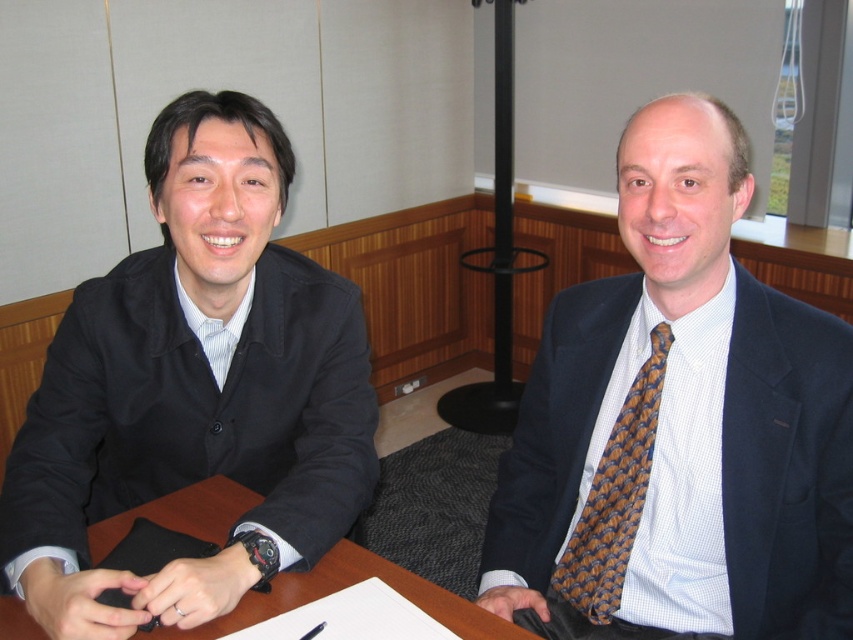
You are a tailor measuring the brown wooden table at center and the brown woven tie at right for a custom order. Which object has a greater width?

The brown wooden table at center has a greater width than the brown woven tie at right.

You are standing at the camera position and want to place a 36 inch wide object on the brown wooden table at center. Can the object fit on the table?

The distance between the brown wooden table at center and the camera is 37.96 inches, but this measurement refers to the distance from the camera to the table, not the table width. Therefore, we cannot determine if the 36 inch wide object will fit on the table based on this information alone.

You are a photographer who needs to capture a closeup of the brown woven tie at right while ensuring the brown wooden table at center remains visible in the frame. Based on their positions, can you position yourself in a way that both objects are in the shot?

The brown wooden table at center is positioned on the left side of brown woven tie at right, so you can position yourself to the left of the brown woven tie at right to include both the brown wooden table at center and the brown woven tie at right in the frame.